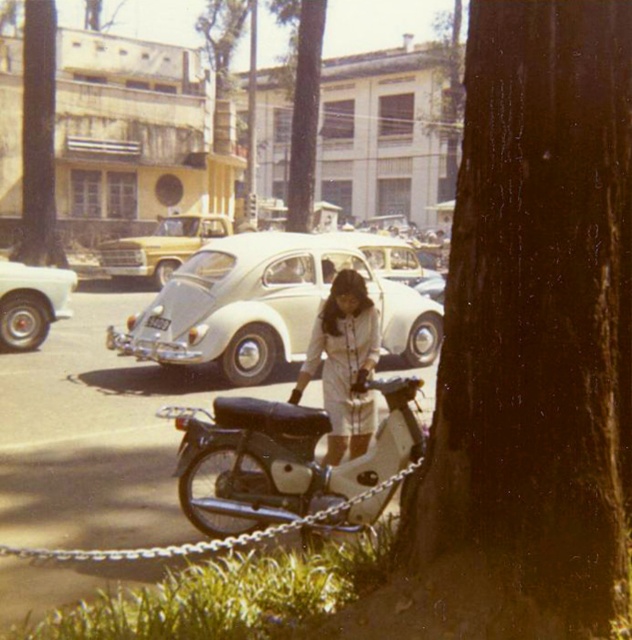
From the picture: You are a pedestrian standing at the edge of the chain barrier. You want to walk to the green rough bark tree at upper center. Is the white matte car at center blocking your path?

The white matte car at center is in front of the green rough bark tree at upper center, so it is blocking your path.

You are a photographer planning to take a picture of the black matte motorcycle at center and the brown rough tree at upper left. Based on their heights, which object should you focus on first if you want to ensure both are in frame without needing to adjust your camera angle?

The black matte motorcycle at center has a lesser height compared to the brown rough tree at upper left, so you should focus on the brown rough tree at upper left first to ensure both are in frame without needing to adjust your camera angle.